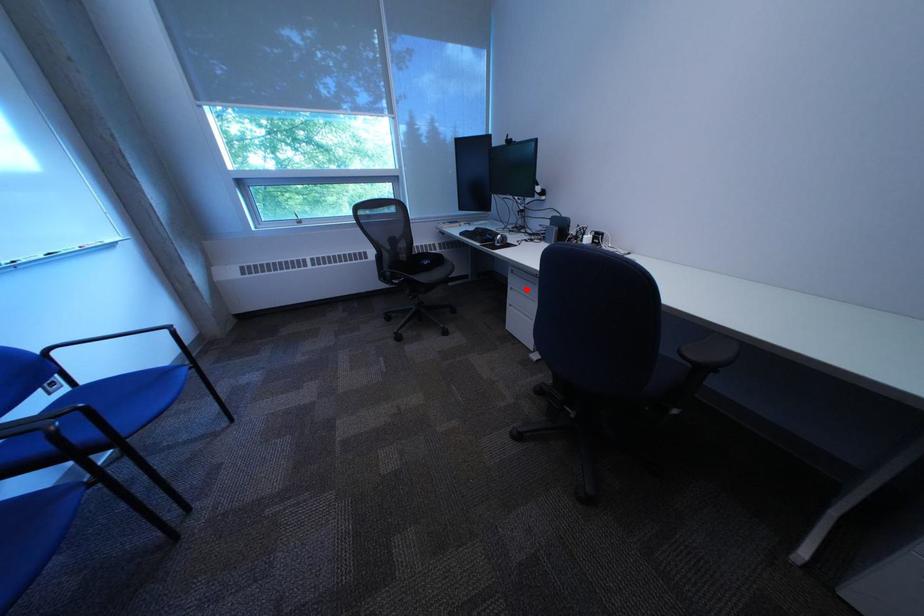
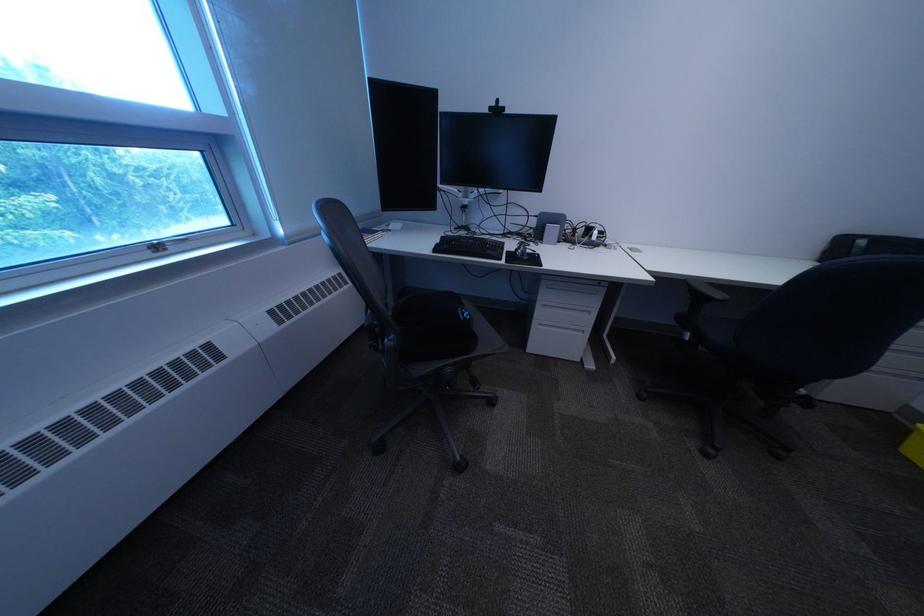
Question: A red point is marked in image1. In image2, is the corresponding 3D point closer to the camera or farther? Reply with the corresponding letter.

Choices:
 (A) The corresponding 3D point is closer.
 (B) The corresponding 3D point is farther.

Answer: (B)